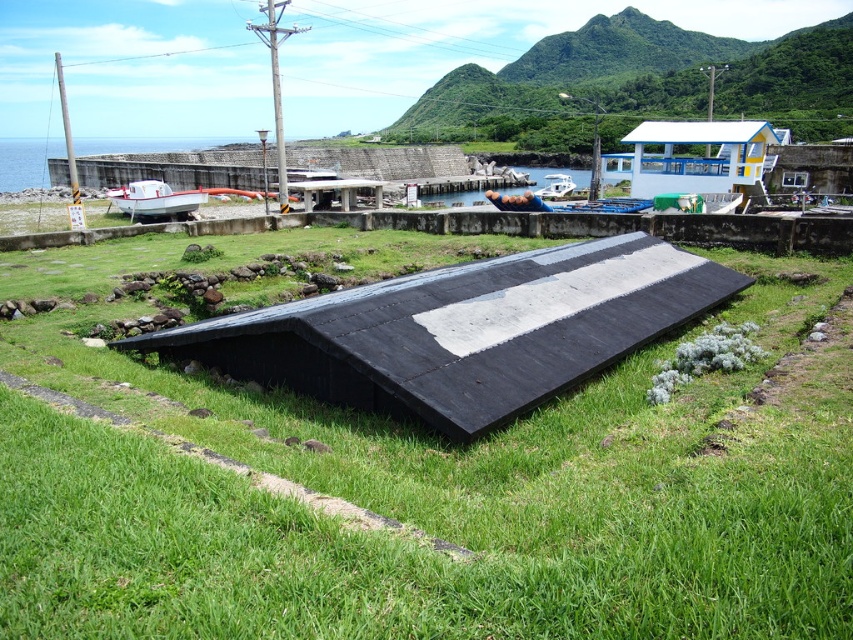
Question: Where is green grass at center located in relation to black rubber dock at center in the image?

Choices:
 (A) above
 (B) below

Answer: (B)

Question: Which object is the closest to the white matte hut at upper right?

Choices:
 (A) white matte boat at center
 (B) black rubber dock at center

Answer: (A)

Question: Is white matte boat at center above white glossy boat at center?

Choices:
 (A) yes
 (B) no

Answer: (B)

Question: Which point is closer to the camera?

Choices:
 (A) (570, 184)
 (B) (445, 428)

Answer: (B)

Question: Does black rubber dock at center have a smaller size compared to white matte boat at center?

Choices:
 (A) no
 (B) yes

Answer: (B)

Question: Which point is closer to the camera?

Choices:
 (A) (780, 570)
 (B) (310, 186)
 (C) (573, 188)

Answer: (A)